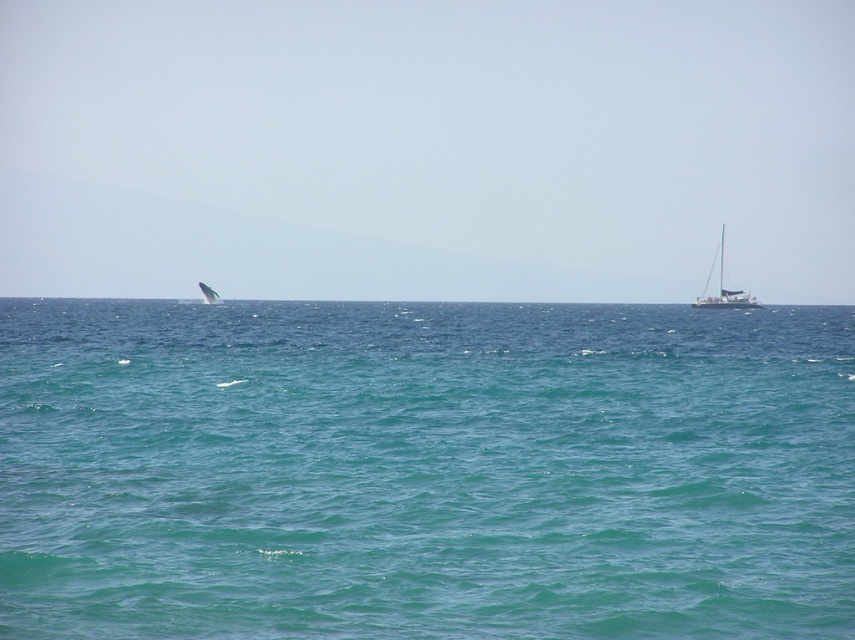
Question: Is the position of teal glossy water at center less distant than that of black matte sailboat at right?

Choices:
 (A) no
 (B) yes

Answer: (B)

Question: Which point is farther from the camera taking this photo?

Choices:
 (A) (721, 232)
 (B) (199, 284)
 (C) (387, 432)

Answer: (A)

Question: Estimate the real-world distances between objects in this image. Which object is closer to the black matte sailboat at right?

Choices:
 (A) white matte whale at upper left
 (B) teal glossy water at center

Answer: (B)

Question: Does black matte sailboat at right lie behind white matte whale at upper left?

Choices:
 (A) yes
 (B) no

Answer: (A)

Question: Estimate the real-world distances between objects in this image. Which object is farther from the teal glossy water at center?

Choices:
 (A) white matte whale at upper left
 (B) black matte sailboat at right

Answer: (B)

Question: Is teal glossy water at center thinner than black matte sailboat at right?

Choices:
 (A) yes
 (B) no

Answer: (B)